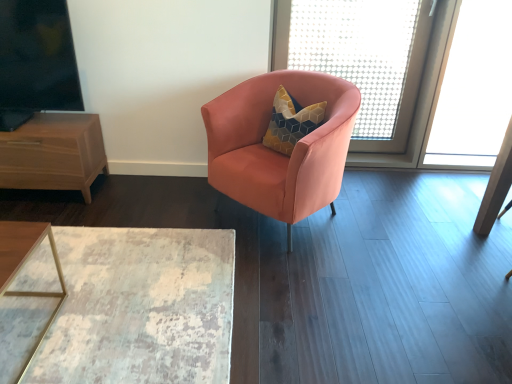
Find the location of a particular element. Image resolution: width=512 pixels, height=384 pixels. vacant region under distressed wood table at lower left (from a real-world perspective) is located at coordinates (128, 272).